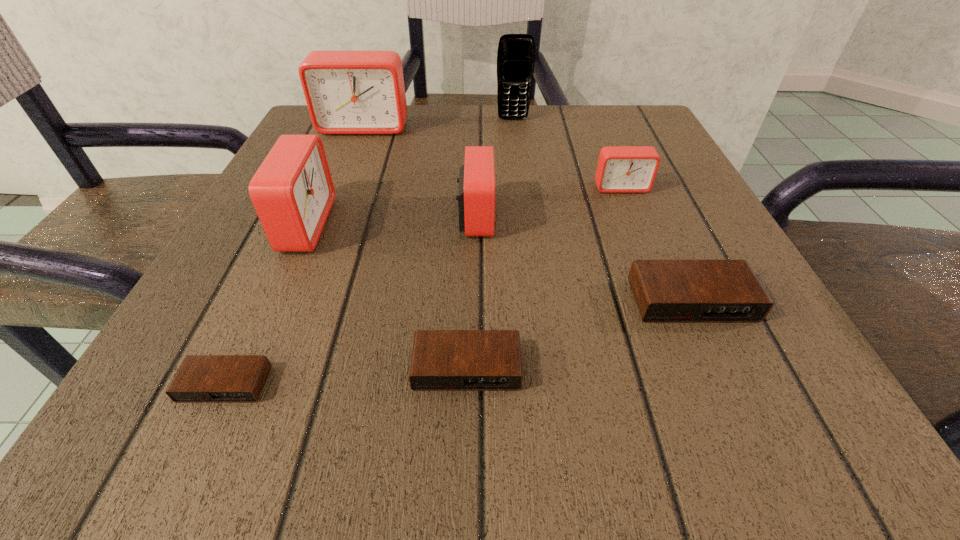
Locate an element on the screen. This screenshot has width=960, height=540. the fifth tallest alarm clock is located at coordinates (666, 291).

At what (x,y) coordinates should I click in order to perform the action: click on the second shortest alarm clock. Please return your answer as a coordinate pair (x, y). The image size is (960, 540). Looking at the image, I should click on (442, 360).

Locate an element on the screen. Image resolution: width=960 pixels, height=540 pixels. the seventh tallest object is located at coordinates (442, 360).

Identify the location of the shortest alarm clock. (200, 378).

Find the location of `the shortest object`. the shortest object is located at coordinates (200, 378).

The image size is (960, 540). What are the coordinates of `vacant space located 0.130m on the screen of the cellular telephone` in the screenshot? It's located at (516, 154).

The image size is (960, 540). What are the coordinates of `free space located on the front-facing side of the biggest red alarm clock` in the screenshot? It's located at (315, 249).

Where is `free space located 0.220m on the front-facing side of the sixth shortest object`? The width and height of the screenshot is (960, 540). free space located 0.220m on the front-facing side of the sixth shortest object is located at coordinates (469, 225).

The height and width of the screenshot is (540, 960). Find the location of `vacant space located on the front-facing side of the second smallest red alarm clock`. vacant space located on the front-facing side of the second smallest red alarm clock is located at coordinates (703, 217).

Locate an element on the screen. free space located on the front-facing side of the smallest red alarm clock is located at coordinates 676,325.